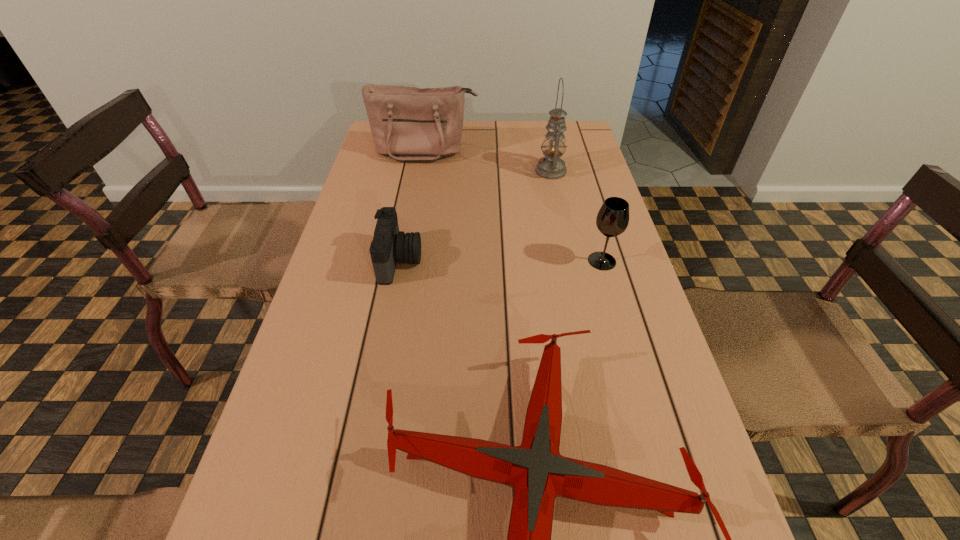
Find the location of `the tallest object`. the tallest object is located at coordinates (551, 166).

At what (x,y) coordinates should I click in order to perform the action: click on shoulder bag. Please return your answer as a coordinate pair (x, y). Looking at the image, I should click on (407, 123).

I want to click on the third tallest object, so click(612, 219).

I want to click on camera, so click(389, 246).

Identify the location of vacant region located on the front of the tallest object. (558, 203).

Locate an element on the screen. The image size is (960, 540). free space located 0.170m on the front pocket of the fourth shortest object is located at coordinates pyautogui.click(x=418, y=196).

The image size is (960, 540). Find the location of `vacant area located on the left of the third shortest object`. vacant area located on the left of the third shortest object is located at coordinates (434, 261).

Identify the location of vacant area located 0.280m at the lens of the camera. This screenshot has height=540, width=960. (534, 261).

Locate an element on the screen. This screenshot has width=960, height=540. object located at the far edge is located at coordinates (407, 123).

Identify the location of shoulder bag situated at the left edge. This screenshot has width=960, height=540. pos(407,123).